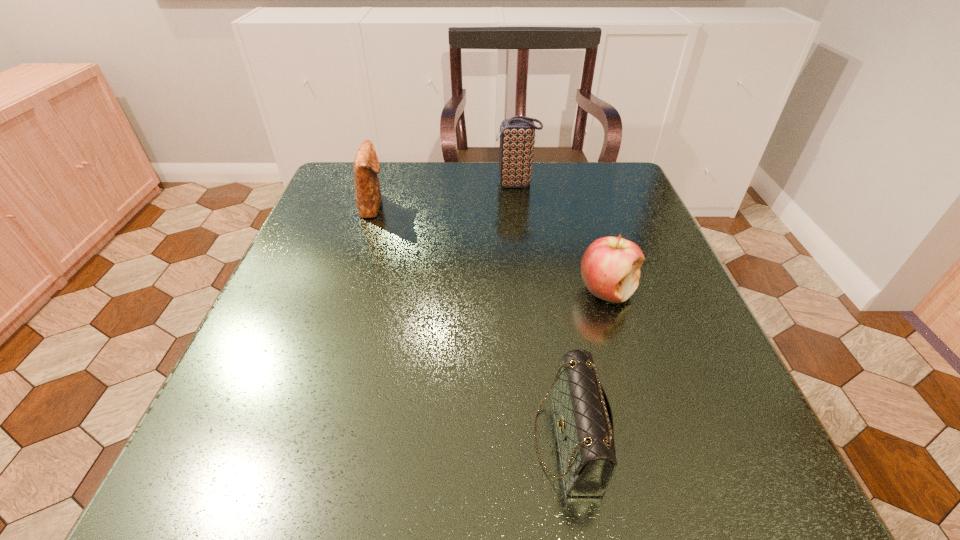
The height and width of the screenshot is (540, 960). In the image, there is a desktop. Find the location of `free space at the far edge`. free space at the far edge is located at coordinates (513, 200).

You are a GUI agent. You are given a task and a screenshot of the screen. Output one action in this format:
    pyautogui.click(x=<x>, y=<y>)
    Task: Click on the vacant space at the left edge
    This screenshot has width=960, height=540.
    Given the screenshot: What is the action you would take?
    pyautogui.click(x=297, y=267)

Find the location of a particular element. The width and height of the screenshot is (960, 540). vacant space at the right edge of the desktop is located at coordinates (615, 307).

The width and height of the screenshot is (960, 540). In the image, there is a desktop. What are the coordinates of `free space at the far left corner` in the screenshot? It's located at (329, 179).

Where is `blank space at the far right corner of the desktop`? This screenshot has width=960, height=540. blank space at the far right corner of the desktop is located at coordinates (605, 212).

Locate an element on the screen. vacant region between the leftmost object and the rightmost object is located at coordinates (491, 248).

Identify the location of vacant point located between the tallest object and the nearest clutch bag. This screenshot has height=540, width=960. (541, 312).

Find the location of a particular element. empty location between the nearest object and the second shortest clutch bag is located at coordinates [470, 322].

The width and height of the screenshot is (960, 540). Find the location of `vacant area that lies between the tallest clutch bag and the second tallest object`. vacant area that lies between the tallest clutch bag and the second tallest object is located at coordinates (444, 195).

Find the location of a particular element. free space between the tallest object and the shortest clutch bag is located at coordinates (541, 312).